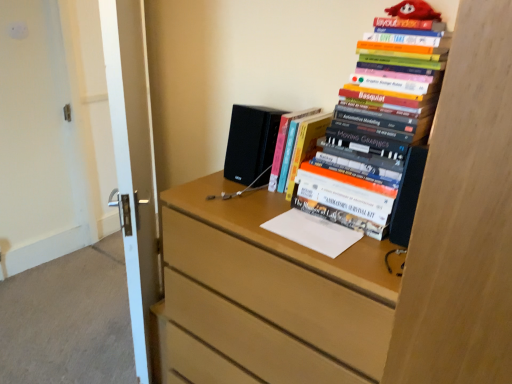
Question: Is white glossy door at left thinner than light wood chest of drawers at center?

Choices:
 (A) yes
 (B) no

Answer: (A)

Question: Is white glossy door at left oriented towards light wood chest of drawers at center?

Choices:
 (A) yes
 (B) no

Answer: (B)

Question: Does white glossy door at left lie in front of light wood chest of drawers at center?

Choices:
 (A) no
 (B) yes

Answer: (A)

Question: Is white glossy door at left to the right of light wood chest of drawers at center from the viewer's perspective?

Choices:
 (A) yes
 (B) no

Answer: (B)

Question: Does white glossy door at left have a larger size compared to light wood chest of drawers at center?

Choices:
 (A) no
 (B) yes

Answer: (A)

Question: From the image's perspective, is light wood chest of drawers at center located above or below black matte speaker at center?

Choices:
 (A) above
 (B) below

Answer: (B)

Question: Considering the positions of light wood chest of drawers at center and black matte speaker at center in the image, is light wood chest of drawers at center wider or thinner than black matte speaker at center?

Choices:
 (A) thin
 (B) wide

Answer: (B)

Question: Is light wood chest of drawers at center situated inside black matte speaker at center or outside?

Choices:
 (A) outside
 (B) inside

Answer: (A)

Question: From a real-world perspective, relative to black matte speaker at center, is light wood chest of drawers at center vertically above or below?

Choices:
 (A) below
 (B) above

Answer: (A)

Question: Do you think white glossy door at left is within light wood chest of drawers at center, or outside of it?

Choices:
 (A) outside
 (B) inside

Answer: (A)

Question: Would you say white glossy door at left is to the left or to the right of light wood chest of drawers at center in the picture?

Choices:
 (A) left
 (B) right

Answer: (A)

Question: Is white glossy door at left taller or shorter than light wood chest of drawers at center?

Choices:
 (A) short
 (B) tall

Answer: (B)

Question: Is white glossy door at left in front of or behind light wood chest of drawers at center in the image?

Choices:
 (A) front
 (B) behind

Answer: (B)

Question: From a real-world perspective, relative to hardcover book at center, placed as the 1th book when sorted from left to right, is light wood chest of drawers at center vertically above or below?

Choices:
 (A) above
 (B) below

Answer: (B)

Question: Considering the positions of light wood chest of drawers at center and hardcover book at center, placed as the 1th book when sorted from left to right, in the image, is light wood chest of drawers at center taller or shorter than hardcover book at center, placed as the 1th book when sorted from left to right,?

Choices:
 (A) short
 (B) tall

Answer: (B)